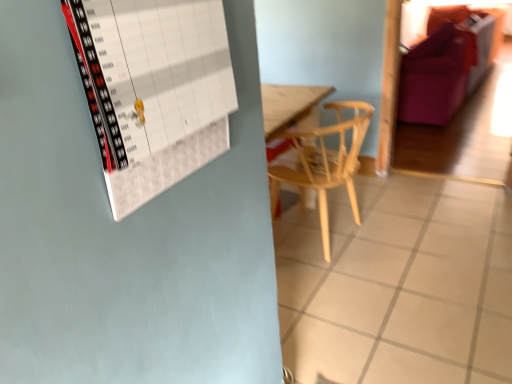
Image resolution: width=512 pixels, height=384 pixels. What do you see at coordinates (399, 285) in the screenshot?
I see `white tile at center` at bounding box center [399, 285].

The height and width of the screenshot is (384, 512). What do you see at coordinates (156, 89) in the screenshot?
I see `white paper calendar at upper left` at bounding box center [156, 89].

Where is `light wood chair at center`? This screenshot has height=384, width=512. light wood chair at center is located at coordinates (326, 162).

The image size is (512, 384). I want to click on white tile at center, so click(399, 285).

How distant is purple fabric couch at upper right from light wood chair at center?

purple fabric couch at upper right and light wood chair at center are 5.56 feet apart from each other.

Would you consider purple fabric couch at upper right to be distant from light wood chair at center?

Yes, purple fabric couch at upper right and light wood chair at center are located far from each other.

Can you tell me how much purple fabric couch at upper right and light wood chair at center differ in facing direction?

The facing directions of purple fabric couch at upper right and light wood chair at center are 85.8 degrees apart.

Which is in front, purple fabric couch at upper right or light wood chair at center?

light wood chair at center is more forward.

Which of these two, light wood chair at center or white tile at center, is wider?

With larger width is white tile at center.

You are a GUI agent. You are given a task and a screenshot of the screen. Output one action in this format:
    pyautogui.click(x=<x>, y=<y>)
    Task: Click on the chair behind the white tile at center
    This screenshot has height=384, width=512.
    Given the screenshot: What is the action you would take?
    pyautogui.click(x=326, y=162)

Is light wood chair at center looking in the opposite direction of white tile at center?

No, light wood chair at center is not facing away from white tile at center.

Does light wood chair at center have a lesser height compared to white tile at center?

Incorrect, the height of light wood chair at center does not fall short of that of white tile at center.

Consider the image. What's the angular difference between white paper calendar at upper left and white tile at center's facing directions?

The facing directions of white paper calendar at upper left and white tile at center are 90.4 degrees apart.

How far apart are white paper calendar at upper left and white tile at center?

The distance of white paper calendar at upper left from white tile at center is 4.72 feet.

Is point (159, 36) closer or farther from the camera than point (504, 211)?

Point (159, 36) is closer to the camera than point (504, 211).

Is white paper calendar at upper left taller or shorter than white tile at center?

white paper calendar at upper left is taller than white tile at center.

From the image's perspective, is purple fabric couch at upper right over white paper calendar at upper left?

Yes, from the image's perspective, purple fabric couch at upper right is on top of white paper calendar at upper left.

Can you confirm if purple fabric couch at upper right is bigger than white paper calendar at upper left?

Correct, purple fabric couch at upper right is larger in size than white paper calendar at upper left.

Which object is positioned more to the right, purple fabric couch at upper right or white paper calendar at upper left?

purple fabric couch at upper right is more to the right.

From the picture: From a real-world perspective, is purple fabric couch at upper right on white paper calendar at upper left?

No, from a real-world perspective, purple fabric couch at upper right is not on top of white paper calendar at upper left.

Which of these two, purple fabric couch at upper right or white tile at center, stands shorter?

With less height is white tile at center.

How different are the orientations of purple fabric couch at upper right and white tile at center in degrees?

purple fabric couch at upper right and white tile at center are facing 3.99 degrees away from each other.

Considering the positions of point (431, 86) and point (360, 245), is point (431, 86) closer or farther from the camera than point (360, 245)?

Clearly, point (431, 86) is more distant from the camera than point (360, 245).

Where is `bulletin board below the purple fabric couch at upper right (from the image's perspective)`? The width and height of the screenshot is (512, 384). bulletin board below the purple fabric couch at upper right (from the image's perspective) is located at coordinates (156, 89).

Is white paper calendar at upper left oriented towards purple fabric couch at upper right?

No.

In the scene shown: Can you confirm if white paper calendar at upper left is shorter than purple fabric couch at upper right?

Correct, white paper calendar at upper left is not as tall as purple fabric couch at upper right.

From the picture: Is white paper calendar at upper left not close to purple fabric couch at upper right?

Yes, white paper calendar at upper left is far from purple fabric couch at upper right.

From a real-world perspective, between white tile at center and white paper calendar at upper left, who is vertically lower?

white tile at center, from a real-world perspective.

Find the location of `tile behind the white paper calendar at upper left`. tile behind the white paper calendar at upper left is located at coordinates (399, 285).

Considering the sizes of objects white tile at center and white paper calendar at upper left in the image provided, who is bigger, white tile at center or white paper calendar at upper left?

white tile at center is bigger.

From the image's perspective, is white tile at center positioned above or below white paper calendar at upper left?

Based on their image positions, white tile at center is located beneath white paper calendar at upper left.

Find the location of `couch behind the light wood chair at center`. couch behind the light wood chair at center is located at coordinates (444, 66).

In order to click on chair above the white tile at center (from a real-world perspective) in this screenshot , I will do `click(326, 162)`.

From the image, which object appears to be farther from light wood chair at center, white tile at center or white paper calendar at upper left?

white paper calendar at upper left lies further to light wood chair at center than the other object.

From the image, which object appears to be farther from white paper calendar at upper left, purple fabric couch at upper right or white tile at center?

Based on the image, purple fabric couch at upper right appears to be further to white paper calendar at upper left.

Looking at the image, which one is located closer to light wood chair at center, purple fabric couch at upper right or white paper calendar at upper left?

Based on the image, white paper calendar at upper left appears to be nearer to light wood chair at center.

Looking at the image, which one is located further to white paper calendar at upper left, light wood chair at center or purple fabric couch at upper right?

purple fabric couch at upper right.

Based on their spatial positions, is white tile at center or purple fabric couch at upper right closer to white paper calendar at upper left?

white tile at center.

Looking at this image, looking at the image, which one is located further to light wood chair at center, purple fabric couch at upper right or white tile at center?

Among the two, purple fabric couch at upper right is located further to light wood chair at center.

Considering their positions, is purple fabric couch at upper right positioned closer to white tile at center than white paper calendar at upper left?

Based on the image, white paper calendar at upper left appears to be nearer to white tile at center.

Looking at this image, estimate the real-world distances between objects in this image. Which object is closer to purple fabric couch at upper right, white paper calendar at upper left or light wood chair at center?

light wood chair at center lies closer to purple fabric couch at upper right than the other object.

Identify the location of tile positioned between white paper calendar at upper left and light wood chair at center from near to far. Image resolution: width=512 pixels, height=384 pixels. (399, 285).

Image resolution: width=512 pixels, height=384 pixels. I want to click on chair located between white tile at center and purple fabric couch at upper right in the depth direction, so click(326, 162).

Identify the location of tile located between white paper calendar at upper left and purple fabric couch at upper right in the depth direction. The image size is (512, 384). (399, 285).

The width and height of the screenshot is (512, 384). Identify the location of chair positioned between white paper calendar at upper left and purple fabric couch at upper right from near to far. (326, 162).